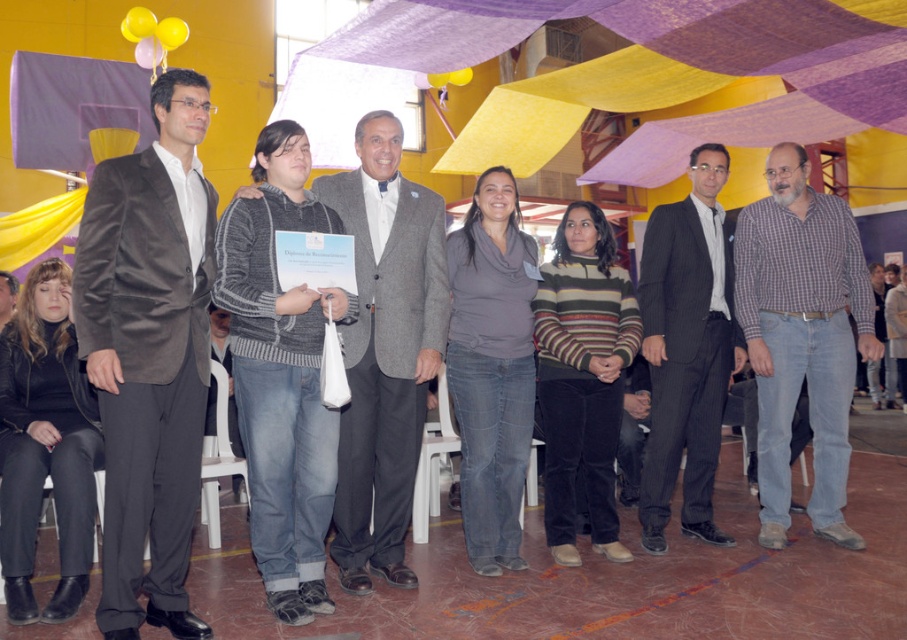
Question: Can you confirm if plaid cotton shirt at right is smaller than black leather jacket at lower left?

Choices:
 (A) yes
 (B) no

Answer: (A)

Question: Which of these objects is positioned closest to the plaid cotton shirt at right?

Choices:
 (A) black leather jacket at lower left
 (B) gray sweater at center
 (C) dark gray pinstripe suit at center

Answer: (C)

Question: Is plaid cotton shirt at right to the left of black leather jacket at lower left from the viewer's perspective?

Choices:
 (A) yes
 (B) no

Answer: (B)

Question: Which of the following is the closest to the observer?

Choices:
 (A) (795, 372)
 (B) (712, 211)
 (C) (319, 449)
 (D) (51, 362)

Answer: (C)

Question: Which object is positioned farthest from the velvet brown blazer at center?

Choices:
 (A) gray sweater at center
 (B) dark gray pinstripe suit at center
 (C) plaid cotton shirt at right
 (D) black leather jacket at lower left

Answer: (C)

Question: Is velvet brown blazer at center to the right of knitted sweater at center from the viewer's perspective?

Choices:
 (A) no
 (B) yes

Answer: (A)